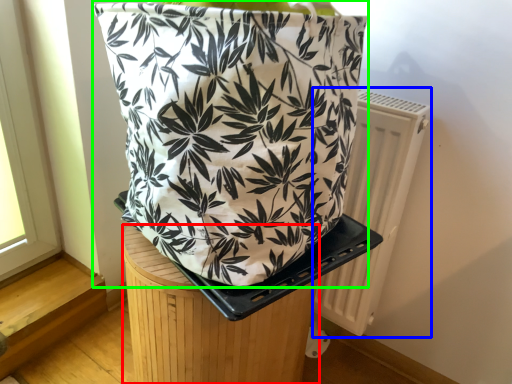
Question: Estimate the real-world distances between objects in this image. Which object is farther from furniture (highlighted by a red box), radiator (highlighted by a blue box) or handbag (highlighted by a green box)?

Choices:
 (A) radiator
 (B) handbag

Answer: (A)